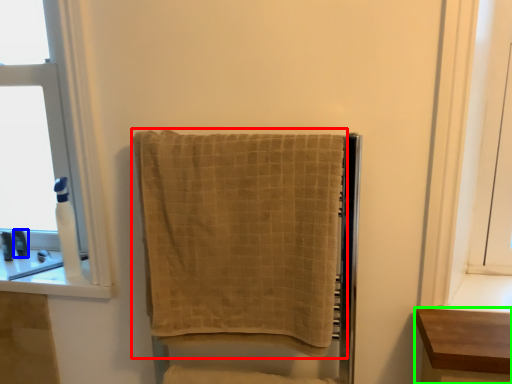
Question: Which object is positioned farthest from towel (highlighted by a red box)? Select from toiletry (highlighted by a blue box) and furniture (highlighted by a green box).

Choices:
 (A) toiletry
 (B) furniture

Answer: (A)